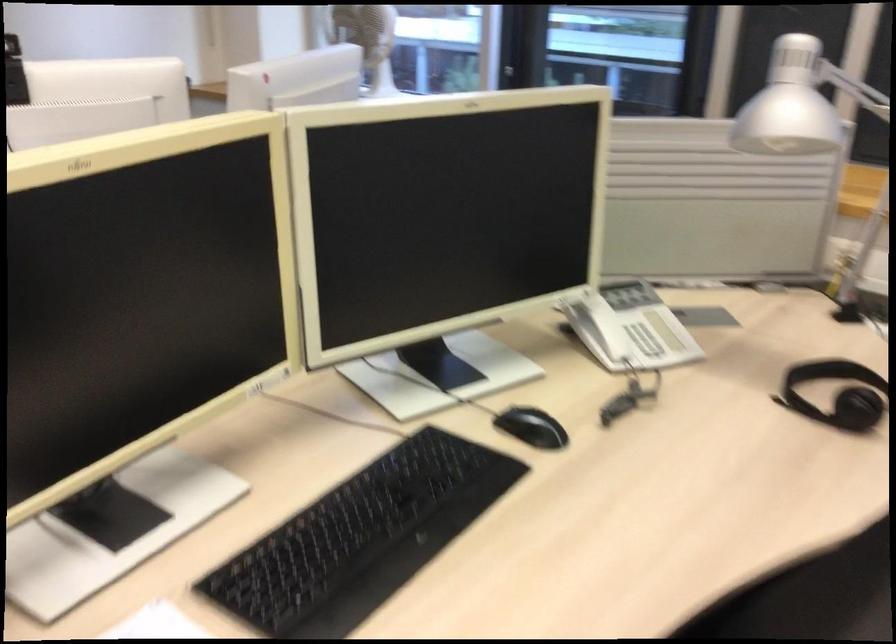
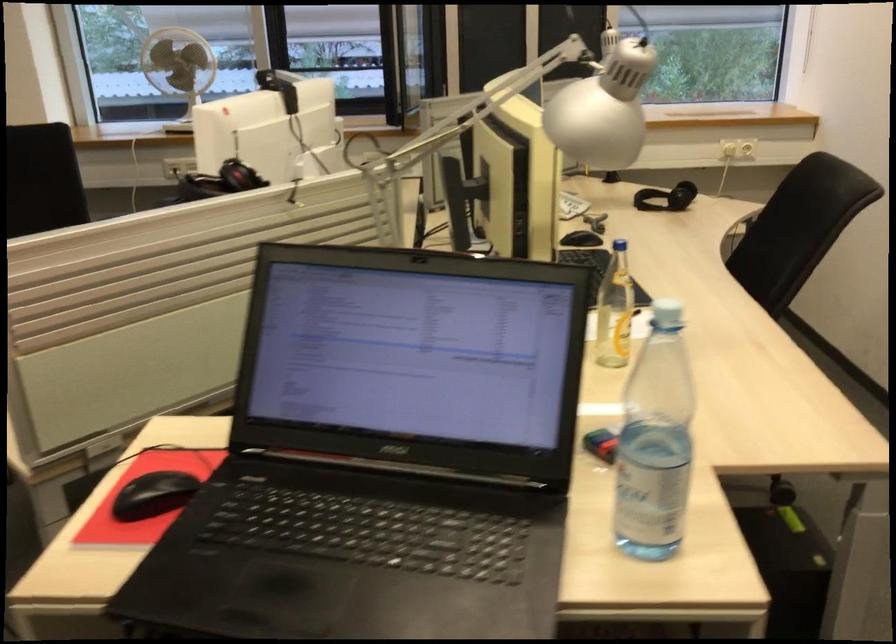
Question: I am providing you with two images of the same scene from different viewpoints. Which of the following objects are not visible in image2?

Choices:
 (A) white desk fan
 (B) telephone handset
 (C) copper pen cup
 (D) black computer mouse

Answer: (B)